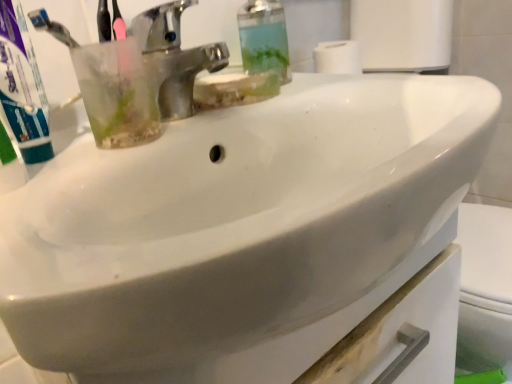
Question: From the image's perspective, is transparent plastic soap dispenser at upper center on polished chrome faucet at upper center?

Choices:
 (A) no
 (B) yes

Answer: (B)

Question: Considering the relative positions of transparent plastic soap dispenser at upper center and polished chrome faucet at upper center in the image provided, is transparent plastic soap dispenser at upper center in front of polished chrome faucet at upper center?

Choices:
 (A) no
 (B) yes

Answer: (A)

Question: Would you say transparent plastic soap dispenser at upper center contains polished chrome faucet at upper center?

Choices:
 (A) yes
 (B) no

Answer: (B)

Question: Does transparent plastic soap dispenser at upper center come behind polished chrome faucet at upper center?

Choices:
 (A) yes
 (B) no

Answer: (A)

Question: From a real-world perspective, is transparent plastic soap dispenser at upper center physically above polished chrome faucet at upper center?

Choices:
 (A) yes
 (B) no

Answer: (A)

Question: From a real-world perspective, is green matte toothpaste at left above or below transparent plastic soap dispenser at upper center?

Choices:
 (A) below
 (B) above

Answer: (A)

Question: Based on their positions, is green matte toothpaste at left located to the left or right of transparent plastic soap dispenser at upper center?

Choices:
 (A) right
 (B) left

Answer: (B)

Question: From their relative heights in the image, would you say green matte toothpaste at left is taller or shorter than transparent plastic soap dispenser at upper center?

Choices:
 (A) tall
 (B) short

Answer: (B)

Question: Would you say green matte toothpaste at left is inside or outside transparent plastic soap dispenser at upper center?

Choices:
 (A) outside
 (B) inside

Answer: (A)

Question: From the image's perspective, is polished chrome faucet at upper center positioned above or below transparent plastic soap dispenser at upper center?

Choices:
 (A) above
 (B) below

Answer: (B)

Question: Choose the correct answer: Is polished chrome faucet at upper center inside transparent plastic soap dispenser at upper center or outside it?

Choices:
 (A) outside
 (B) inside

Answer: (A)

Question: Looking at their shapes, would you say polished chrome faucet at upper center is wider or thinner than transparent plastic soap dispenser at upper center?

Choices:
 (A) thin
 (B) wide

Answer: (B)

Question: In terms of size, does polished chrome faucet at upper center appear bigger or smaller than transparent plastic soap dispenser at upper center?

Choices:
 (A) small
 (B) big

Answer: (B)

Question: Considering their positions, is transparent plastic soap dispenser at upper center located in front of or behind polished chrome faucet at upper center?

Choices:
 (A) front
 (B) behind

Answer: (B)

Question: From the image's perspective, is transparent plastic soap dispenser at upper center above or below polished chrome faucet at upper center?

Choices:
 (A) above
 (B) below

Answer: (A)